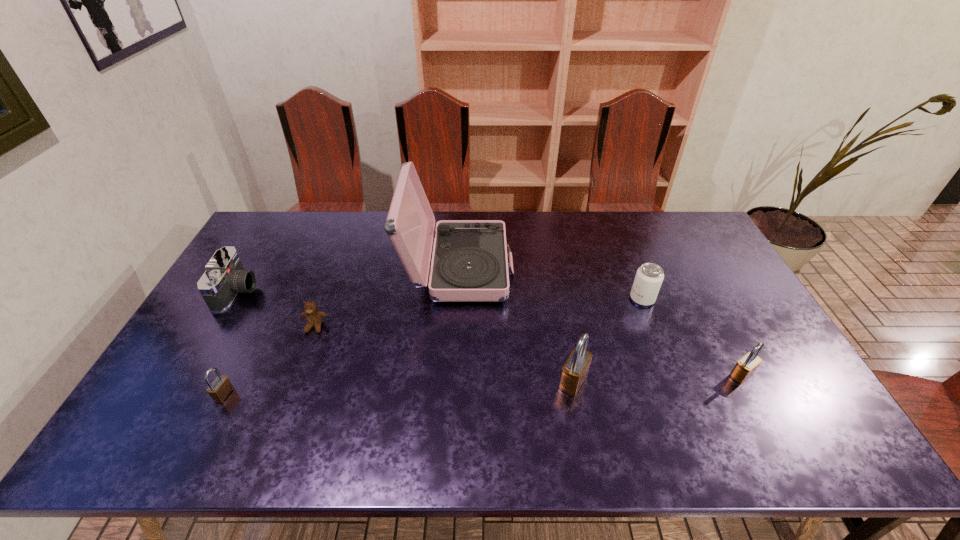
Find the location of `record player`. record player is located at coordinates click(x=469, y=263).

Identify the location of the leftmost object. The height and width of the screenshot is (540, 960). (224, 277).

Where is `vacant space located 0.290m on the right of the shortest padlock`? vacant space located 0.290m on the right of the shortest padlock is located at coordinates (347, 395).

The height and width of the screenshot is (540, 960). Find the location of `vacant region located on the right of the sixth shortest object`. vacant region located on the right of the sixth shortest object is located at coordinates (666, 381).

At what (x,y) coordinates should I click in order to perform the action: click on vacant region located 0.080m on the right of the rightmost object. Please return your answer as a coordinate pair (x, y). The image size is (960, 540). Looking at the image, I should click on (784, 375).

Find the location of `vacant space located on the right of the second object from right to left`. vacant space located on the right of the second object from right to left is located at coordinates (697, 299).

The height and width of the screenshot is (540, 960). What are the coordinates of `vacant space located at the face of the teddy bear` in the screenshot? It's located at (290, 395).

Image resolution: width=960 pixels, height=540 pixels. Identify the location of vacant space located with the lid open on the fourth object from left to right. (558, 268).

This screenshot has height=540, width=960. In order to click on free location located 0.230m on the front-facing side of the leftmost object in this screenshot , I will do point(328,292).

Image resolution: width=960 pixels, height=540 pixels. I want to click on object positioned at the far edge, so click(469, 263).